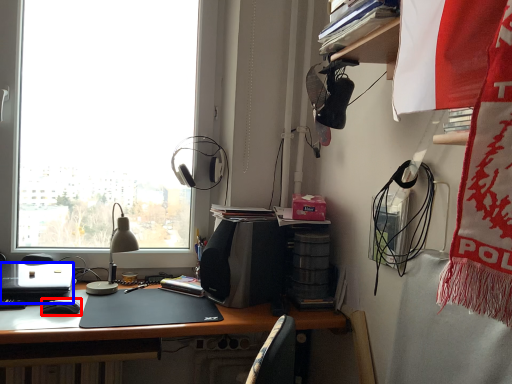
Question: Which of the following is the farthest to the observer, mouse (highlighted by a red box) or laptop (highlighted by a blue box)?

Choices:
 (A) mouse
 (B) laptop

Answer: (A)